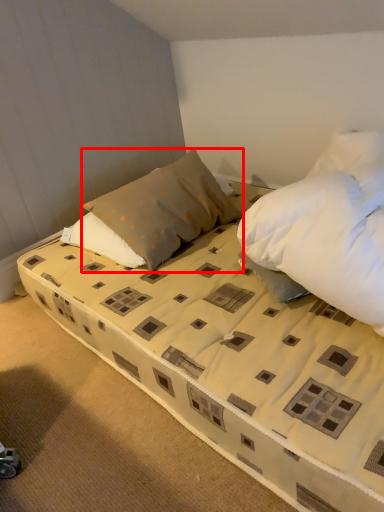
Question: In this image, where is pillow (annotated by the red box) located relative to bed?

Choices:
 (A) left
 (B) right

Answer: (A)